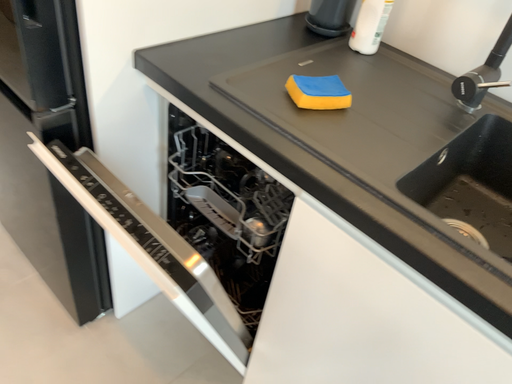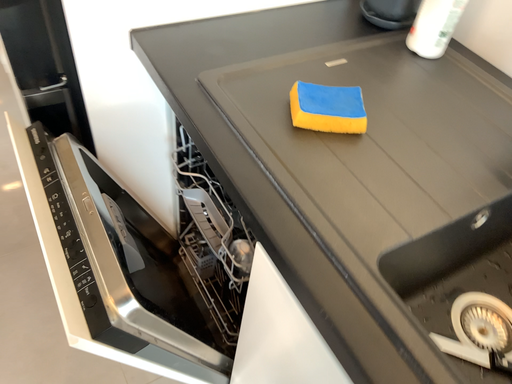
Question: Which way did the camera rotate in the video?

Choices:
 (A) rotated right
 (B) rotated left

Answer: (B)